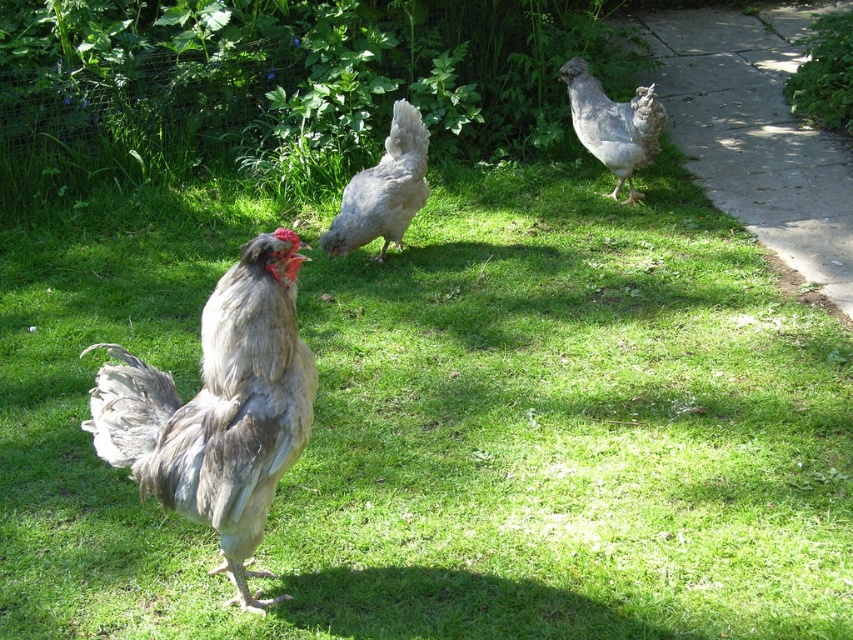
Question: Which of the following is the closest to the observer?

Choices:
 (A) (410, 109)
 (B) (612, 134)
 (C) (672, 35)
 (D) (91, 401)

Answer: (D)

Question: Is gray feathered rooster at center behind concrete at right?

Choices:
 (A) yes
 (B) no

Answer: (B)

Question: Can you confirm if gray matte chicken at center is positioned to the right of gray feathered chicken at right?

Choices:
 (A) no
 (B) yes

Answer: (A)

Question: Which point appears closest to the camera in this image?

Choices:
 (A) (676, 68)
 (B) (643, 108)

Answer: (B)

Question: Which of the following is the farthest from the observer?

Choices:
 (A) (576, 92)
 (B) (747, 200)
 (C) (259, 608)

Answer: (B)

Question: Can you confirm if concrete at right is positioned to the left of gray matte chicken at center?

Choices:
 (A) yes
 (B) no

Answer: (B)